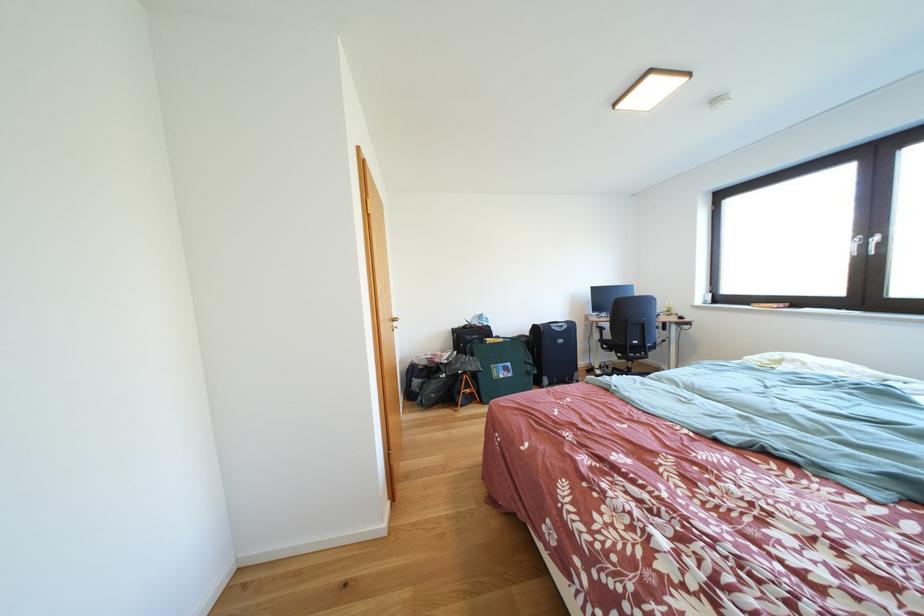
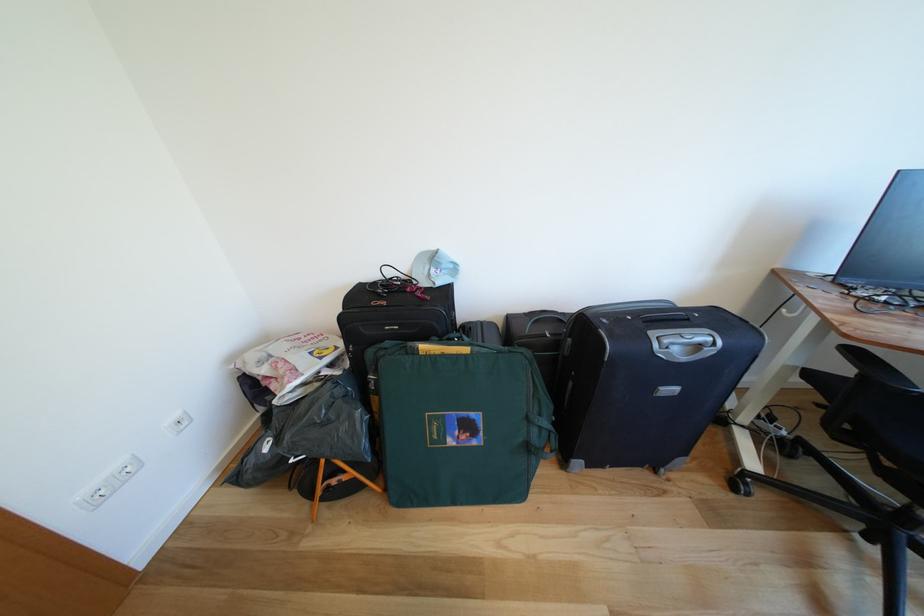
Where in the second image is the point corresponding to point 489,321 from the first image?

(442, 262)